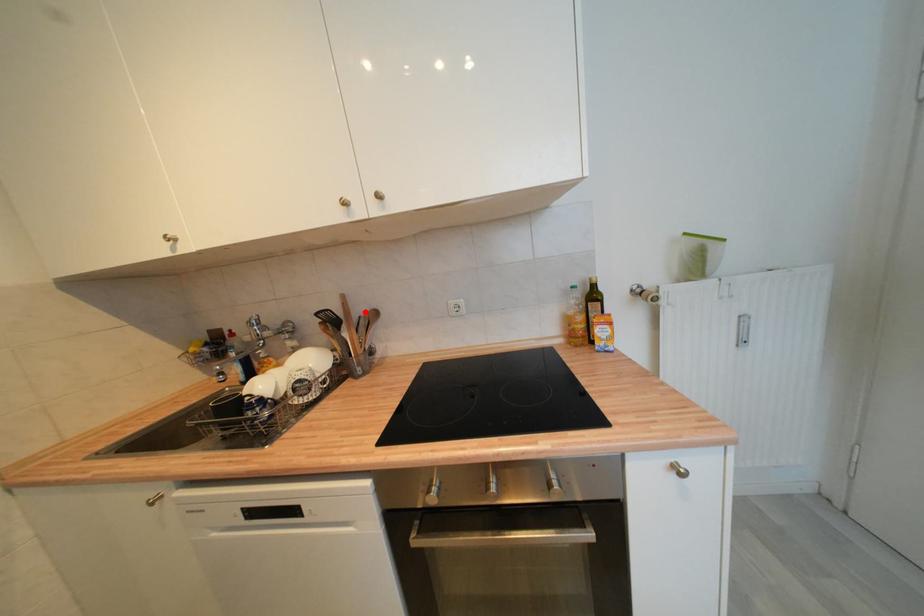
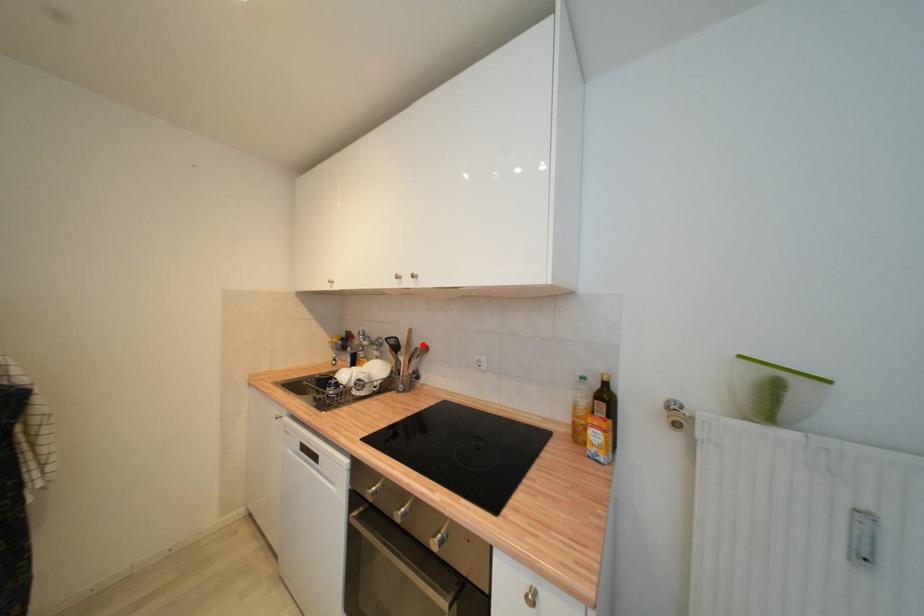
I am providing you with two images of the same scene from different viewpoints. A red point is marked on the first image and another point is marked on the second image. Are the points marked in image1 and image2 representing the same 3D position?

Yes